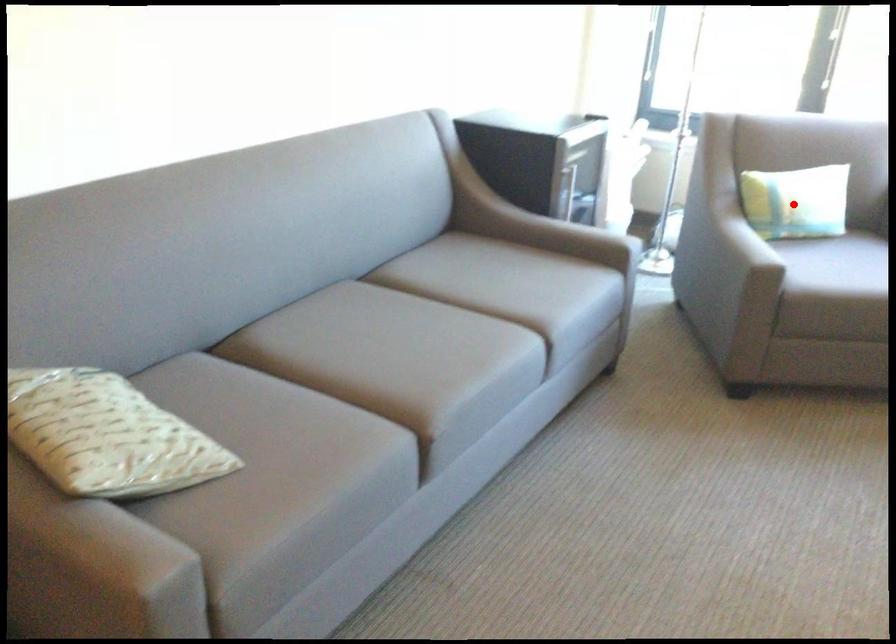
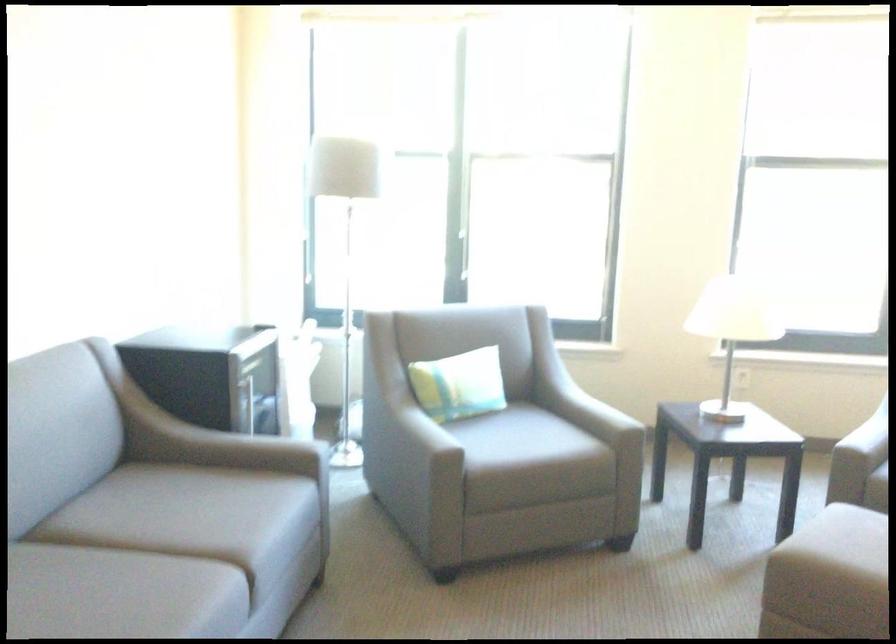
Find the pixel in the second image that matches the highlighted location in the first image.

(459, 384)